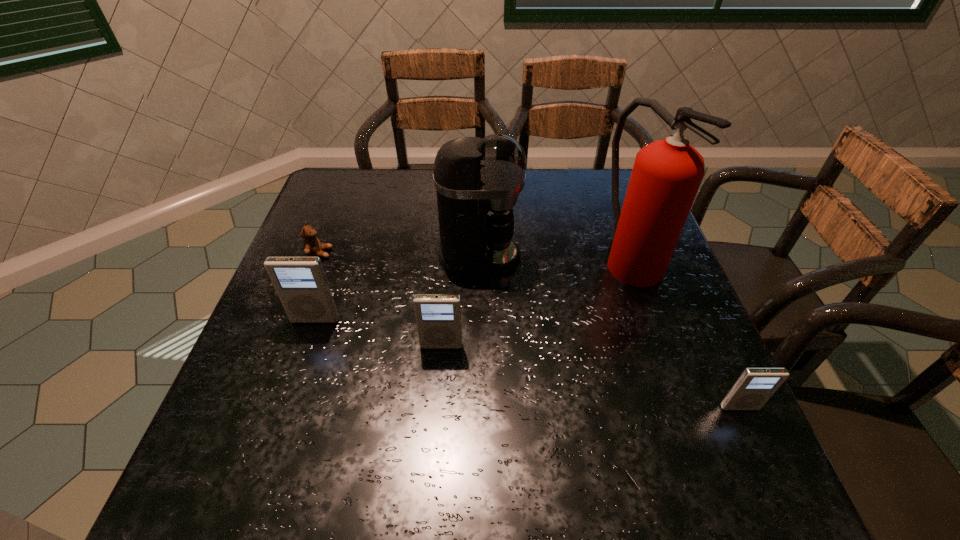
What are the coordinates of `free spot between the nearest iPod and the leftmost iPod` in the screenshot? It's located at pyautogui.click(x=527, y=363).

You are a GUI agent. You are given a task and a screenshot of the screen. Output one action in this format:
    pyautogui.click(x=<x>, y=<y>)
    Task: Click on the object that is the nearest to the teddy bear
    This screenshot has height=540, width=960.
    Given the screenshot: What is the action you would take?
    pyautogui.click(x=301, y=284)

Find the location of a particular element. The width and height of the screenshot is (960, 540). the second closest object relative to the second nearest object is located at coordinates (478, 181).

Where is `the second closest iPod relative to the fifth tallest object`? The height and width of the screenshot is (540, 960). the second closest iPod relative to the fifth tallest object is located at coordinates (301, 284).

Identify the location of iPod that stands as the closest to the teddy bear. Image resolution: width=960 pixels, height=540 pixels. (301, 284).